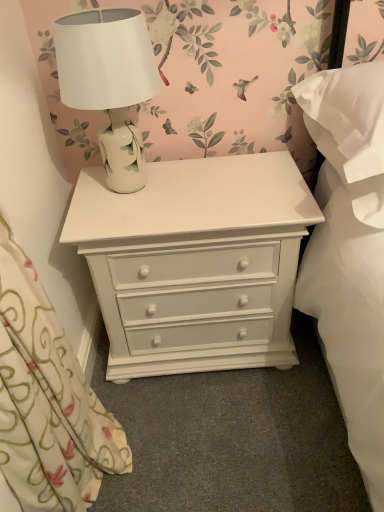
Question: Is white ceramic lamp at upper center in front of or behind floral fabric curtain at left in the image?

Choices:
 (A) behind
 (B) front

Answer: (A)

Question: Would you say white ceramic lamp at upper center is to the left or to the right of floral fabric curtain at left in the picture?

Choices:
 (A) right
 (B) left

Answer: (A)

Question: Which is farther from the white ceramic lamp at upper center?

Choices:
 (A) white painted wood chest of drawers at center
 (B) floral fabric curtain at left
 (C) white soft pillow at right

Answer: (C)

Question: Which of these objects is positioned closest to the white ceramic lamp at upper center?

Choices:
 (A) white soft pillow at right
 (B) white painted wood chest of drawers at center
 (C) floral fabric curtain at left

Answer: (B)